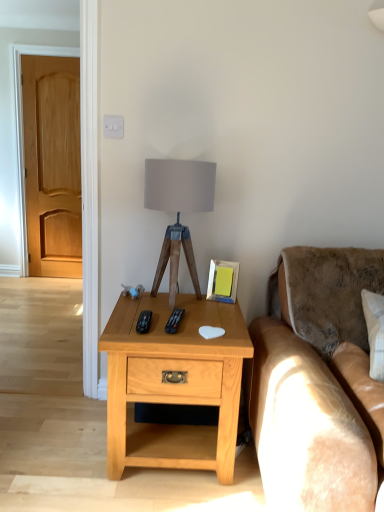
In order to click on free space to the left of light wood/texturedesk at center in this screenshot , I will do `click(59, 445)`.